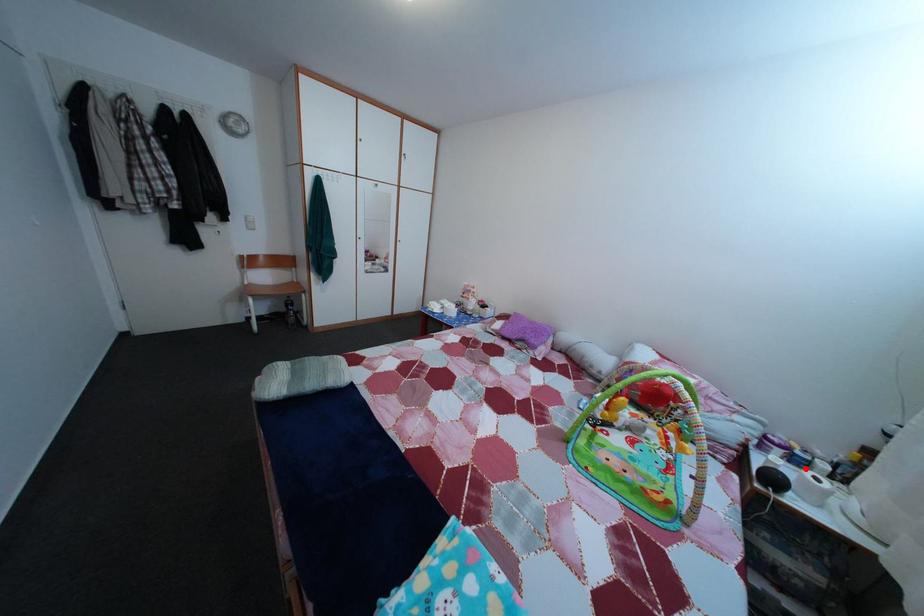
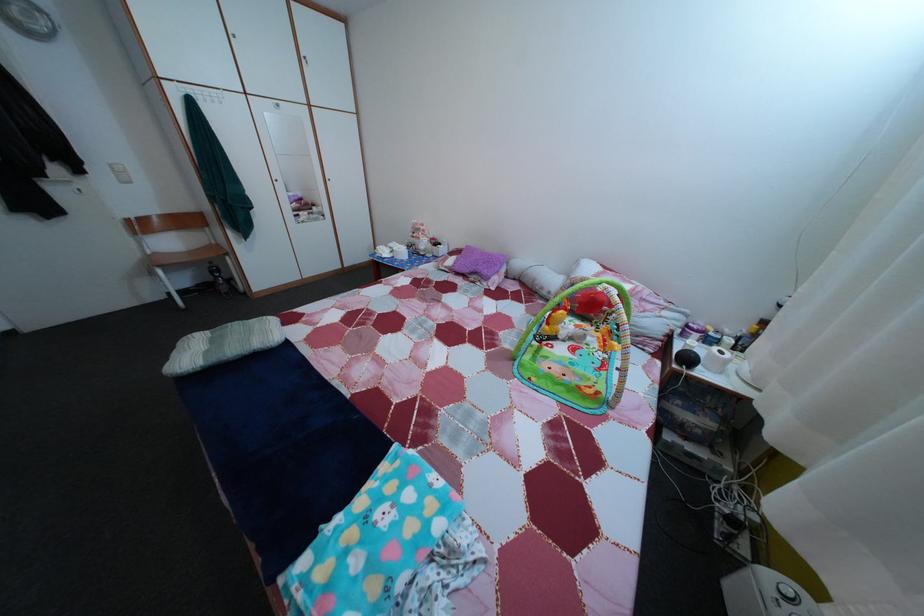
Where in the second image is the point corresponding to the highlighted location from the first image?

(718, 349)